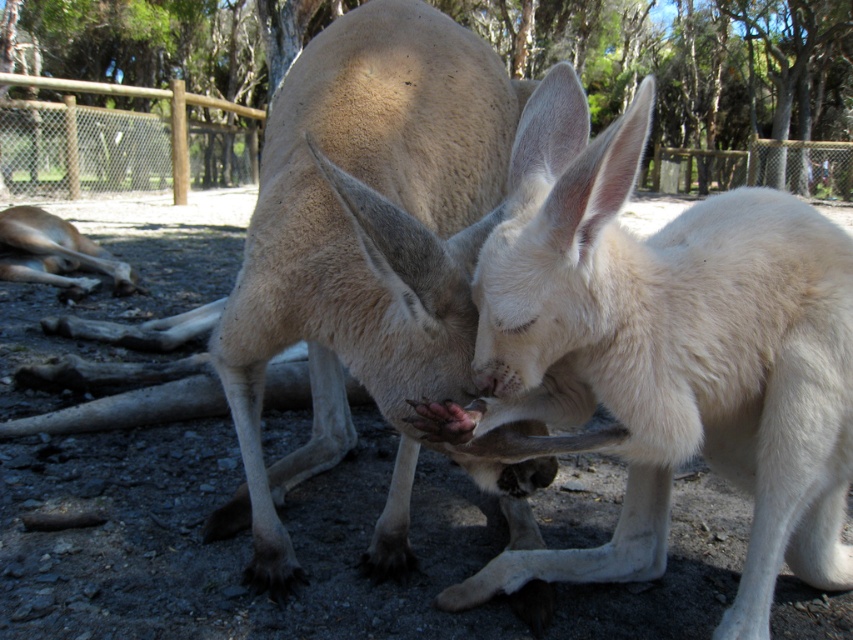
Question: Which object appears farthest from the camera in this image?

Choices:
 (A) light brown fur at lower left
 (B) wooden fence at upper left
 (C) white fur kangaroo at center

Answer: (B)

Question: Is light brown fur at lower left to the right of wooden fence at upper left from the viewer's perspective?

Choices:
 (A) yes
 (B) no

Answer: (A)

Question: Where is light brown fur at center located in relation to wooden fence at upper left in the image?

Choices:
 (A) above
 (B) below

Answer: (B)

Question: Which object is positioned farthest from the light brown fur at center?

Choices:
 (A) wooden fence at upper left
 (B) white fur kangaroo at center
 (C) light brown fur at lower left

Answer: (A)

Question: Where is white fur kangaroo at center located in relation to light brown fur at center in the image?

Choices:
 (A) above
 (B) below

Answer: (B)

Question: Which of these objects is positioned farthest from the white fur kangaroo at center?

Choices:
 (A) light brown fur at center
 (B) light brown fur at lower left
 (C) wooden fence at upper left

Answer: (C)